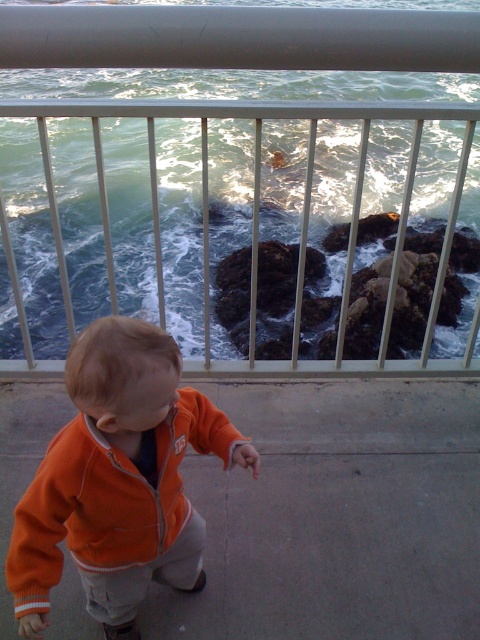
You are a parent trying to ensure your child stays safe near the ocean. You see the metallic silver railing at upper center and the orange fleece jacket at lower left. Which object is closer to the ocean?

The orange fleece jacket at lower left is closer to the ocean because the metallic silver railing at upper center is positioned over it, meaning the railing is above and farther from the ocean compared to the jacket.

You are standing at the point with coordinates point (66, 467) and want to walk to the point with coordinates point (100, 56). Is the destination point in front of or behind you?

The point (100, 56) is behind point (66, 467), so the destination point is behind you.